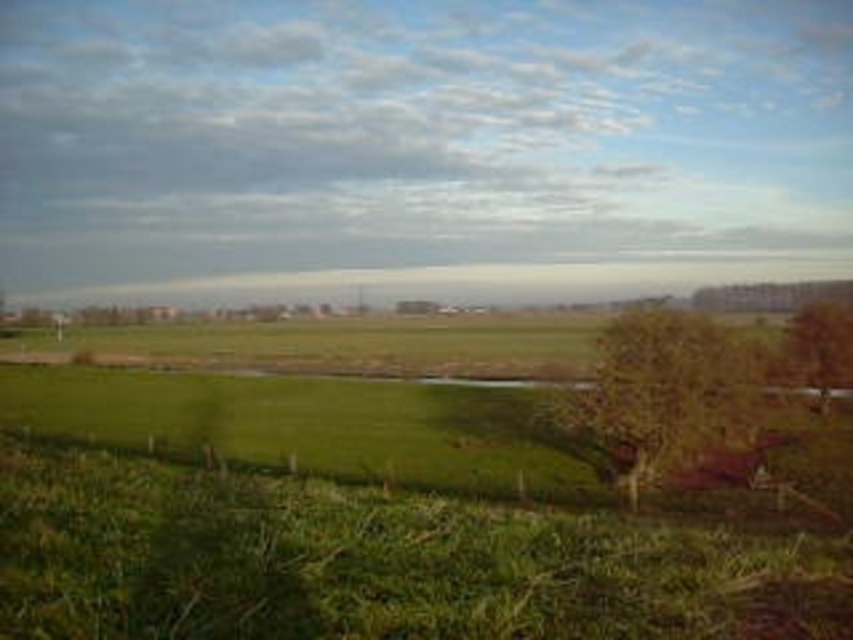
You are standing at the fence and looking towards the field. Which tree, the brown textured tree at center right or the brown textured tree at right, is positioned more to your left side?

The brown textured tree at center right is positioned more to the left side compared to the brown textured tree at right.

You are standing at the fence in the image and want to walk to the brown textured tree at right. As you walk towards it, will the brown textured tree at center right appear to move to your left or right relative to your starting position?

The brown textured tree at center right will appear to move to your left relative to your starting position as you walk towards the brown textured tree at right because it is closer to the viewer and will shift more in your field of view compared to the farther tree.